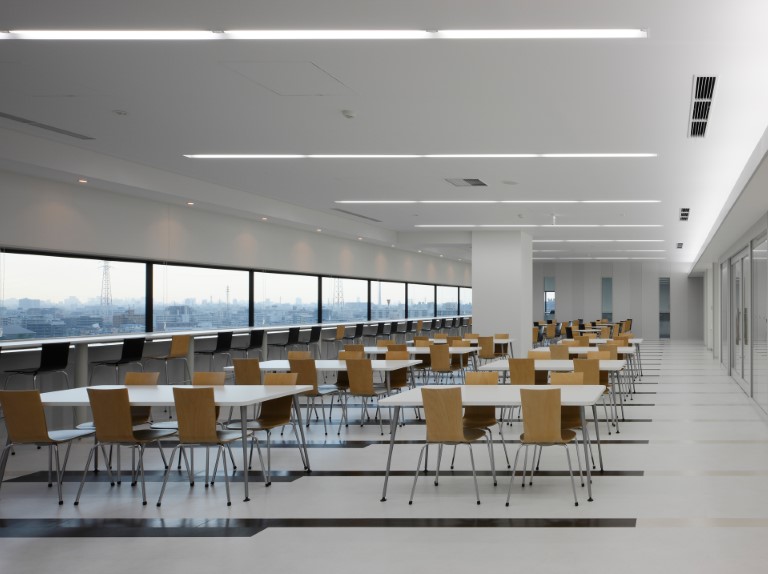
You are a GUI agent. You are given a task and a screenshot of the screen. Output one action in this format:
    pyautogui.click(x=<x>, y=<y>)
    Task: Click on the tables
    The width and height of the screenshot is (768, 574).
    Given the screenshot: What is the action you would take?
    pyautogui.click(x=521, y=398), pyautogui.click(x=554, y=364), pyautogui.click(x=580, y=349), pyautogui.click(x=601, y=341), pyautogui.click(x=256, y=397), pyautogui.click(x=371, y=364), pyautogui.click(x=418, y=351), pyautogui.click(x=502, y=343), pyautogui.click(x=545, y=325), pyautogui.click(x=412, y=321)